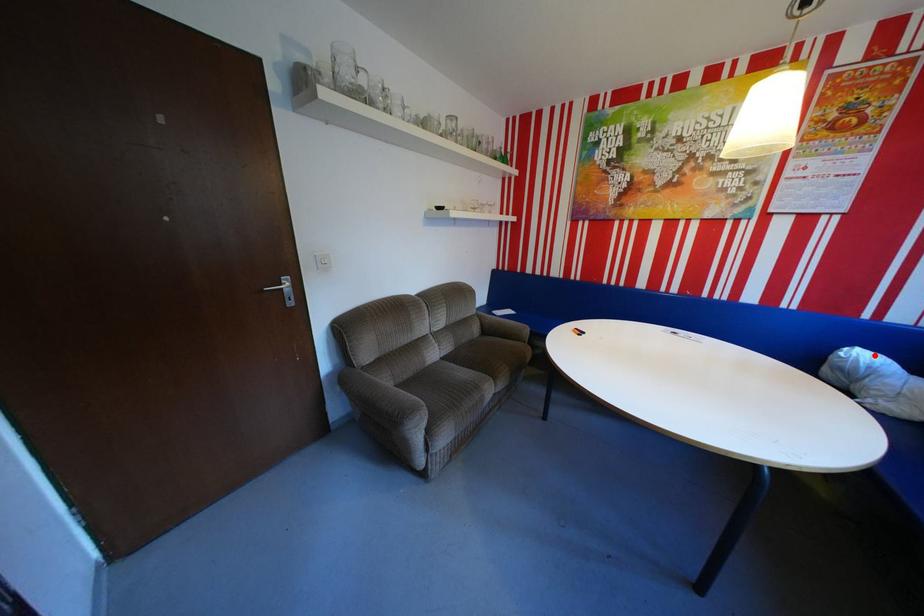
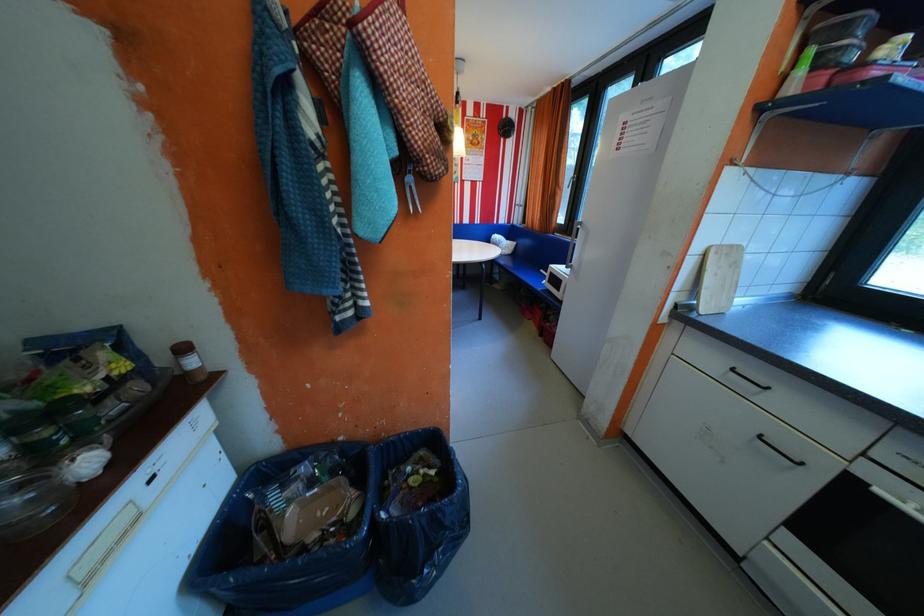
Find the pixel in the second image that matches the highlighted location in the first image.

(507, 236)